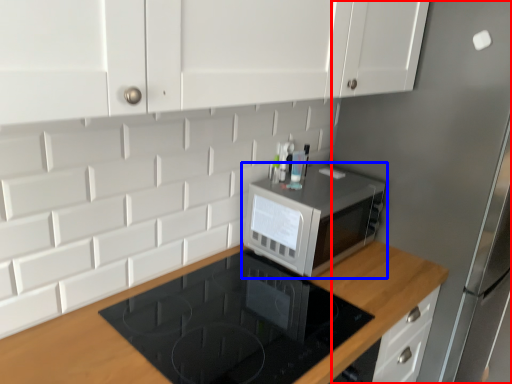
Question: Which object is further to the camera taking this photo, fridge (highlighted by a red box) or microwave oven (highlighted by a blue box)?

Choices:
 (A) fridge
 (B) microwave oven

Answer: (B)